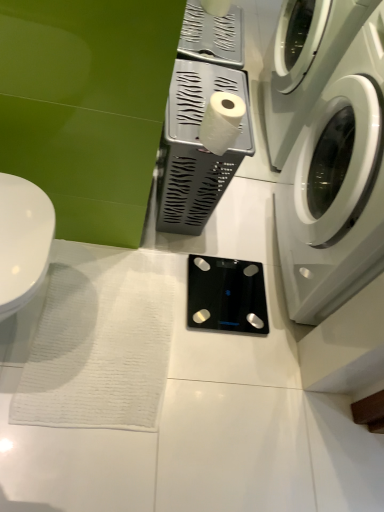
The width and height of the screenshot is (384, 512). I want to click on free spot below white glossy toilet at left (from a real-world perspective), so click(x=40, y=326).